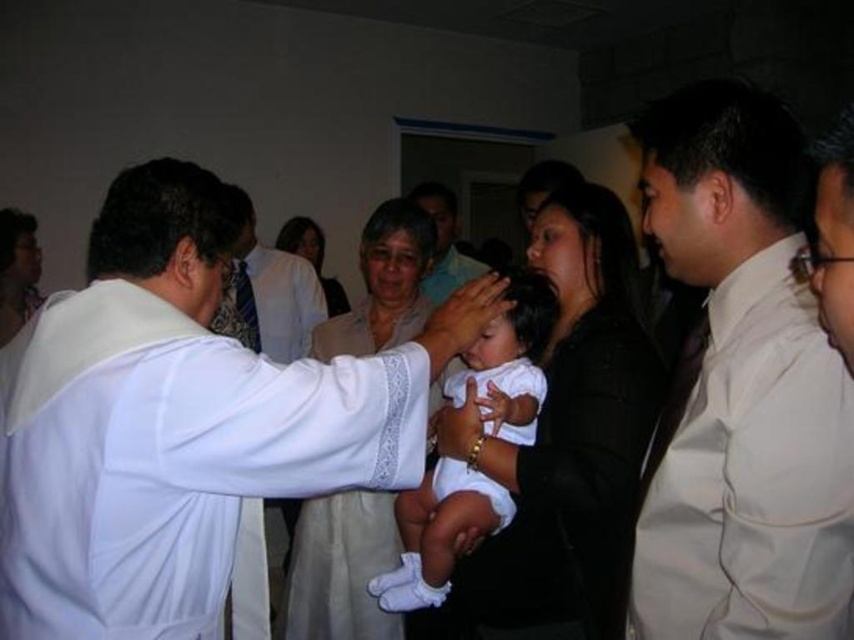
Question: Is white smooth shirt at right to the right of white satin robe at center from the viewer's perspective?

Choices:
 (A) yes
 (B) no

Answer: (A)

Question: Which object appears farthest from the camera in this image?

Choices:
 (A) white smooth shirt at right
 (B) white lace robe at center
 (C) smooth white shirt at center

Answer: (C)

Question: Observing the image, what is the correct spatial positioning of white satin robe at center in reference to matte white dress at center?

Choices:
 (A) right
 (B) left

Answer: (B)

Question: Which of these objects is positioned farthest from the white satin robe at center?

Choices:
 (A) white smooth shirt at right
 (B) white lace dress at center

Answer: (A)

Question: Does white lace robe at center appear under smooth white shirt at center?

Choices:
 (A) no
 (B) yes

Answer: (B)

Question: Which object appears closest to the camera in this image?

Choices:
 (A) white smooth shirt at right
 (B) white satin robe at center
 (C) white lace robe at center
 (D) white clothed baby at center

Answer: (A)